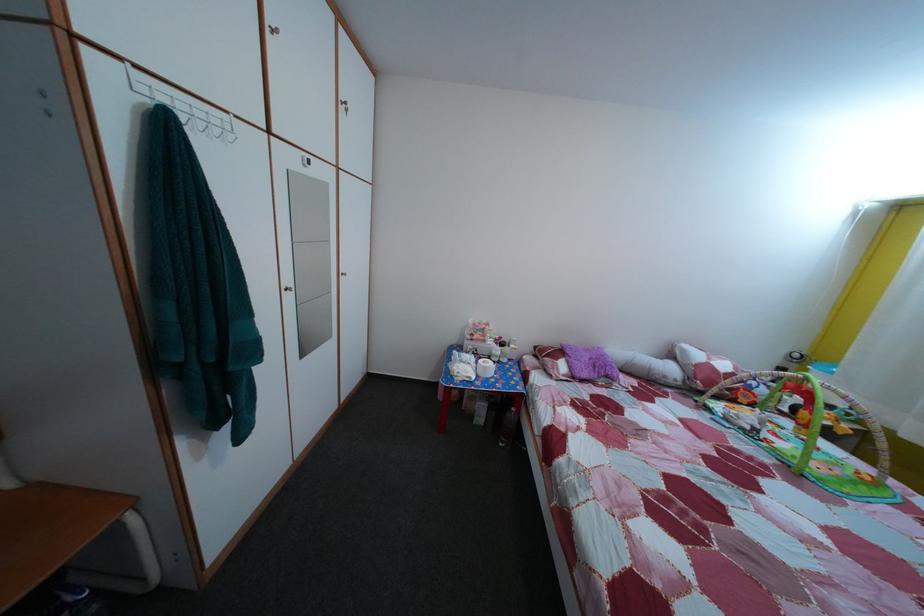
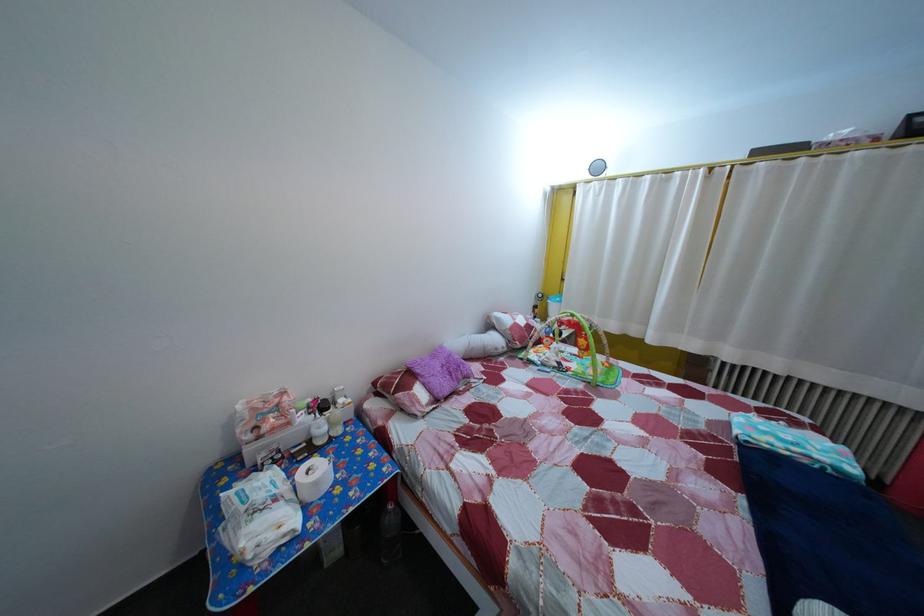
Find the pixel in the second image that matches pixel 493 349 in the first image.

(298, 432)